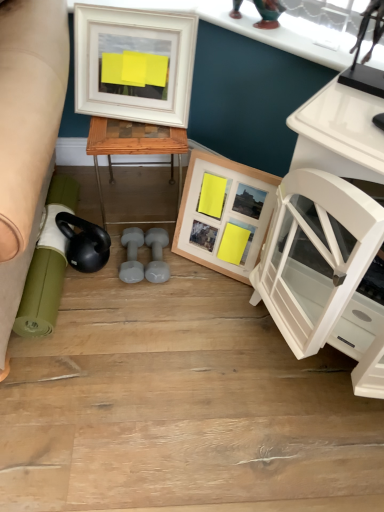
Question: Can you confirm if wooden picture frame at center, which appears as the second picture frame when viewed from the top, is positioned to the right of woodenobject at center?

Choices:
 (A) yes
 (B) no

Answer: (A)

Question: Is wooden picture frame at center, which is the 2th picture frame from left to right, completely or partially outside of woodenobject at center?

Choices:
 (A) no
 (B) yes

Answer: (B)

Question: Is wooden picture frame at center, which is the 2th picture frame from left to right, facing towards woodenobject at center?

Choices:
 (A) no
 (B) yes

Answer: (A)

Question: Is wooden picture frame at center, which is the 2th picture frame from left to right, positioned behind woodenobject at center?

Choices:
 (A) yes
 (B) no

Answer: (B)

Question: Is there a large distance between wooden picture frame at center, which ranks as the first picture frame in bottom-to-top order, and woodenobject at center?

Choices:
 (A) no
 (B) yes

Answer: (A)

Question: From the image's perspective, is white glossy cabinet at right located above or below gray rubber dumbbell at center, acting as the 2th dumbbell starting from the left?

Choices:
 (A) above
 (B) below

Answer: (B)

Question: Is point (352, 353) positioned closer to the camera than point (157, 273)?

Choices:
 (A) farther
 (B) closer

Answer: (B)

Question: In the image, is white glossy cabinet at right on the left side or the right side of gray rubber dumbbell at center, acting as the 2th dumbbell starting from the left?

Choices:
 (A) left
 (B) right

Answer: (B)

Question: From a real-world perspective, relative to gray rubber dumbbell at center, the 1th dumbbell from the right, is white glossy cabinet at right vertically above or below?

Choices:
 (A) below
 (B) above

Answer: (B)

Question: Is woodenobject at center spatially inside green rubber mat at lower left, or outside of it?

Choices:
 (A) outside
 (B) inside

Answer: (A)

Question: In the image, is woodenobject at center positioned in front of or behind green rubber mat at lower left?

Choices:
 (A) front
 (B) behind

Answer: (B)

Question: From a real-world perspective, is woodenobject at center above or below green rubber mat at lower left?

Choices:
 (A) above
 (B) below

Answer: (A)

Question: Considering the positions of woodenobject at center and green rubber mat at lower left in the image, is woodenobject at center taller or shorter than green rubber mat at lower left?

Choices:
 (A) tall
 (B) short

Answer: (A)

Question: Is white glossy cabinet at right situated inside wooden picture frame at center, which is the 2th picture frame from left to right, or outside?

Choices:
 (A) outside
 (B) inside

Answer: (A)

Question: From the image's perspective, is white glossy cabinet at right above or below wooden picture frame at center, marked as the 1th picture frame in a right-to-left arrangement?

Choices:
 (A) below
 (B) above

Answer: (A)